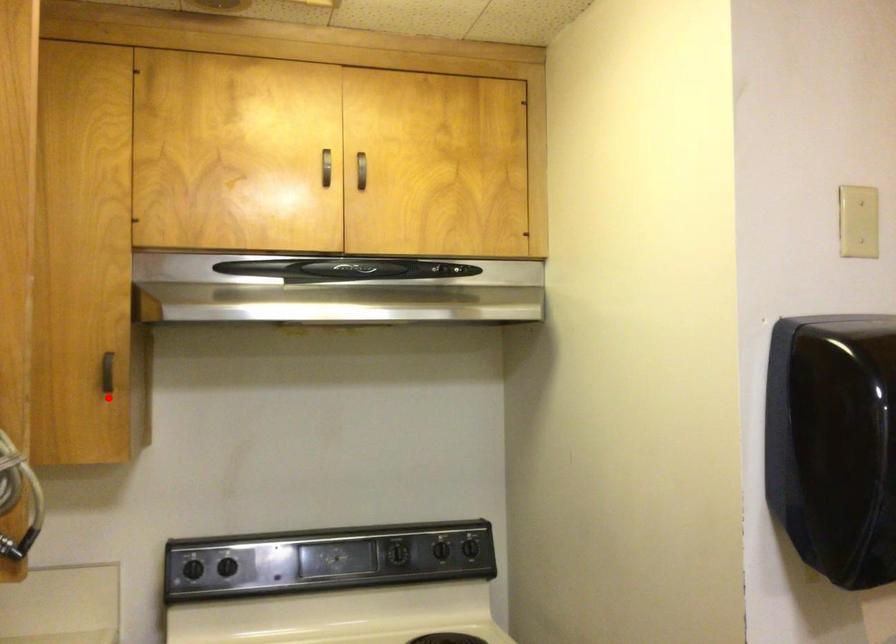
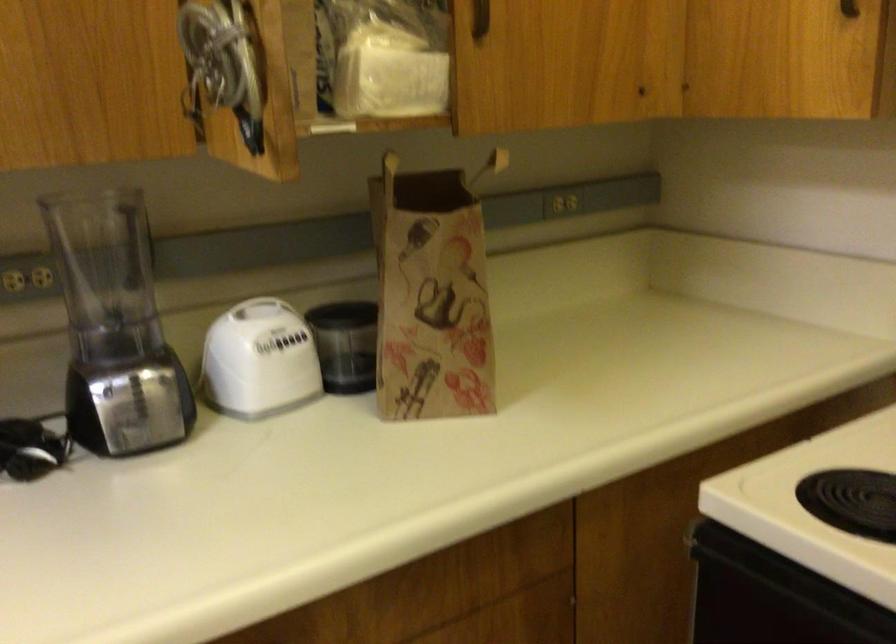
Find the pixel in the second image that matches the highlighted location in the first image.

(849, 8)